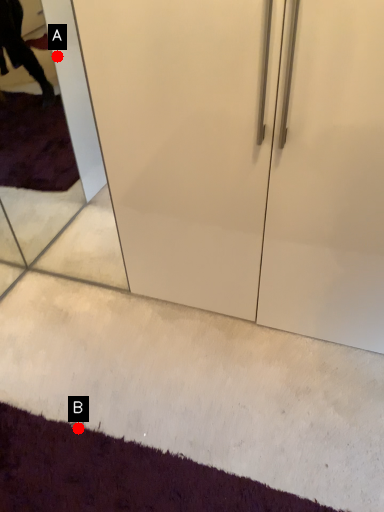
Question: Two points are circled on the image, labeled by A and B beside each circle. Which point is farther from the camera taking this photo?

Choices:
 (A) A is further
 (B) B is further

Answer: (A)